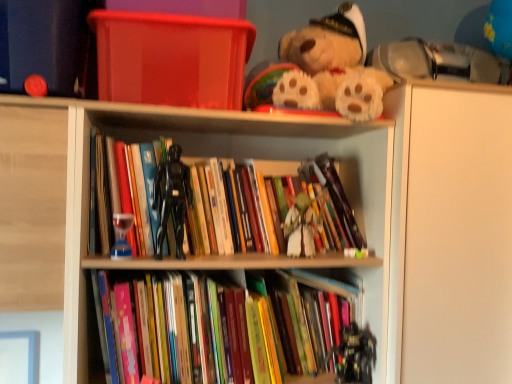
This screenshot has height=384, width=512. I want to click on multicolored paperbacks at center, the 1th book from the top, so click(x=248, y=209).

What do you see at coordinates (248, 209) in the screenshot? The width and height of the screenshot is (512, 384). I see `multicolored paperbacks at center, positioned as the 2th book in bottom-to-top order` at bounding box center [248, 209].

The height and width of the screenshot is (384, 512). Describe the element at coordinates (170, 58) in the screenshot. I see `transparent plastic container at upper center` at that location.

The width and height of the screenshot is (512, 384). Find the location of `white matte figurine at center, which appears as the 1th miniature when viewed from the right`. white matte figurine at center, which appears as the 1th miniature when viewed from the right is located at coordinates (300, 227).

How much space does black plastic robot at lower center, which is the first toy in right-to-left order, occupy vertically?

It is 7.10 inches.

Where is `white matte cabinet at upper right`? The width and height of the screenshot is (512, 384). white matte cabinet at upper right is located at coordinates (450, 234).

Identify the location of translucent glass hourglass at center, acting as the 1th toy starting from the front. (122, 235).

This screenshot has height=384, width=512. Identify the location of multicolored paperbacks at center, positioned as the 2th book in bottom-to-top order. 248,209.

From a real-world perspective, between white matte figurine at center, marked as the first miniature in a back-to-front arrangement, and white matte cabinet at upper right, who is vertically higher?

white matte figurine at center, marked as the first miniature in a back-to-front arrangement, from a real-world perspective.

How many degrees apart are the facing directions of white matte figurine at center, acting as the 2th miniature starting from the left, and white matte cabinet at upper right?

1.98 degrees separate the facing orientations of white matte figurine at center, acting as the 2th miniature starting from the left, and white matte cabinet at upper right.

Can you confirm if white matte figurine at center, acting as the 2th miniature starting from the left, is positioned to the left of white matte cabinet at upper right?

Yes, white matte figurine at center, acting as the 2th miniature starting from the left, is to the left of white matte cabinet at upper right.

What are the coordinates of `the 1st miniature to the left of the white matte cabinet at upper right, counting from the anchor's position` in the screenshot? It's located at (300, 227).

How far apart are white matte cabinet at upper right and hardcover books at center, marked as the second book in a top-to-bottom arrangement?

white matte cabinet at upper right and hardcover books at center, marked as the second book in a top-to-bottom arrangement, are 16.18 inches apart from each other.

Considering their positions, is white matte cabinet at upper right located in front of or behind hardcover books at center, which is the first book in bottom-to-top order?

white matte cabinet at upper right is behind hardcover books at center, which is the first book in bottom-to-top order.

How many degrees apart are the facing directions of white matte cabinet at upper right and hardcover books at center, marked as the second book in a top-to-bottom arrangement?

1.96 degrees separate the facing orientations of white matte cabinet at upper right and hardcover books at center, marked as the second book in a top-to-bottom arrangement.

Is white matte cabinet at upper right thinner than hardcover books at center, marked as the second book in a top-to-bottom arrangement?

Incorrect, the width of white matte cabinet at upper right is not less than that of hardcover books at center, marked as the second book in a top-to-bottom arrangement.

Between white matte cabinet at upper right and black plastic robot at lower center, the 1th toy viewed from the back, which one is positioned behind?

black plastic robot at lower center, the 1th toy viewed from the back.

How many degrees apart are the facing directions of white matte cabinet at upper right and black plastic robot at lower center, placed as the 2th toy when sorted from front to back?

66.5 degrees.

Which is more to the left, white matte cabinet at upper right or black plastic robot at lower center, the second toy when ordered from top to bottom?

black plastic robot at lower center, the second toy when ordered from top to bottom.

The image size is (512, 384). Identify the location of dresser that is on the right side of black plastic robot at lower center, the second toy when ordered from top to bottom. (450, 234).

Based on the photo, from the image's perspective, which is above, black matte figure at center, the first miniature in the front-to-back sequence, or translucent glass hourglass at center, acting as the 1th toy starting from the front?

black matte figure at center, the first miniature in the front-to-back sequence.

Is black matte figure at center, which is the second miniature from back to front, further to camera compared to translucent glass hourglass at center, acting as the second toy starting from the back?

No, black matte figure at center, which is the second miniature from back to front, is in front of translucent glass hourglass at center, acting as the second toy starting from the back.

How different are the orientations of black matte figure at center, the first miniature in the front-to-back sequence, and translucent glass hourglass at center, which is the 2th toy from bottom to top, in degrees?

0.0054 degrees.

Can you confirm if black matte figure at center, placed as the 2th miniature when sorted from right to left, is shorter than translucent glass hourglass at center, acting as the first toy starting from the left?

No.

Who is shorter, wooden books at center or white matte figurine at center, marked as the first miniature in a back-to-front arrangement?

Standing shorter between the two is white matte figurine at center, marked as the first miniature in a back-to-front arrangement.

What's the angular difference between wooden books at center and white matte figurine at center, placed as the 2th miniature when sorted from front to back,'s facing directions?

The facing directions of wooden books at center and white matte figurine at center, placed as the 2th miniature when sorted from front to back, are 2.32 degrees apart.

Is wooden books at center in contact with white matte figurine at center, which appears as the 1th miniature when viewed from the right?

No, wooden books at center is not touching white matte figurine at center, which appears as the 1th miniature when viewed from the right.

Considering their positions, is wooden books at center located in front of or behind white matte figurine at center, placed as the 2th miniature when sorted from front to back?

Visually, wooden books at center is located in front of white matte figurine at center, placed as the 2th miniature when sorted from front to back.

Is point (27, 286) more distant than point (181, 148)?

No, it is in front of (181, 148).

Between wooden books at center and black matte figure at center, which is the second miniature from back to front, which one has smaller size?

black matte figure at center, which is the second miniature from back to front.

Consider the image. From the image's perspective, which object appears higher, wooden books at center or black matte figure at center, placed as the 2th miniature when sorted from right to left?

black matte figure at center, placed as the 2th miniature when sorted from right to left, appears higher in the image.

How different are the orientations of wooden books at center and black matte figure at center, which is the 1th miniature from left to right, in degrees?

wooden books at center and black matte figure at center, which is the 1th miniature from left to right, are facing 1.07 degrees away from each other.

Considering the sizes of objects hardcover books at center, which is the first book in bottom-to-top order, and translucent glass hourglass at center, acting as the 1th toy starting from the front, in the image provided, who is thinner, hardcover books at center, which is the first book in bottom-to-top order, or translucent glass hourglass at center, acting as the 1th toy starting from the front,?

Thinner between the two is translucent glass hourglass at center, acting as the 1th toy starting from the front.

Consider the image. Considering the sizes of objects hardcover books at center, which is the first book in bottom-to-top order, and translucent glass hourglass at center, acting as the 1th toy starting from the front, in the image provided, who is taller, hardcover books at center, which is the first book in bottom-to-top order, or translucent glass hourglass at center, acting as the 1th toy starting from the front,?

Standing taller between the two is hardcover books at center, which is the first book in bottom-to-top order.

Is hardcover books at center, marked as the second book in a top-to-bottom arrangement, inside or outside of translucent glass hourglass at center, which is the 2th toy from bottom to top?

hardcover books at center, marked as the second book in a top-to-bottom arrangement, is located beyond the bounds of translucent glass hourglass at center, which is the 2th toy from bottom to top.

From the picture: Considering the positions of objects hardcover books at center, which is the first book in bottom-to-top order, and translucent glass hourglass at center, which is the 2th toy from bottom to top, in the image provided, who is behind, hardcover books at center, which is the first book in bottom-to-top order, or translucent glass hourglass at center, which is the 2th toy from bottom to top,?

hardcover books at center, which is the first book in bottom-to-top order.

Where is `the 1st miniature positioned above the white matte cabinet at upper right (from the image's perspective)`? This screenshot has height=384, width=512. the 1st miniature positioned above the white matte cabinet at upper right (from the image's perspective) is located at coordinates click(x=300, y=227).

Where is `the 2nd book to the left when counting from the white matte cabinet at upper right`? The width and height of the screenshot is (512, 384). the 2nd book to the left when counting from the white matte cabinet at upper right is located at coordinates (222, 330).

Estimate the real-world distances between objects in this image. Which object is closer to white matte figurine at center, marked as the first miniature in a back-to-front arrangement, hardcover books at center, which is the first book in bottom-to-top order, or black matte figure at center, which is the 1th miniature from left to right?

Among the two, hardcover books at center, which is the first book in bottom-to-top order, is located nearer to white matte figurine at center, marked as the first miniature in a back-to-front arrangement.

Which object lies nearer to the anchor point fluffy beige teddy bear at upper center, hardcover books at center, which is the first book in bottom-to-top order, or transparent plastic container at upper center?

The object closer to fluffy beige teddy bear at upper center is transparent plastic container at upper center.

When comparing their distances from hardcover books at center, marked as the second book in a top-to-bottom arrangement, does fluffy beige teddy bear at upper center or white matte cabinet at upper right seem further?

The object further to hardcover books at center, marked as the second book in a top-to-bottom arrangement, is fluffy beige teddy bear at upper center.

From the image, which object appears to be nearer to translucent glass hourglass at center, acting as the first toy starting from the left, white matte cabinet at upper right or black plastic robot at lower center, which is counted as the first toy, starting from the bottom?

black plastic robot at lower center, which is counted as the first toy, starting from the bottom, is positioned closer to the anchor translucent glass hourglass at center, acting as the first toy starting from the left.

Estimate the real-world distances between objects in this image. Which object is further from black matte figure at center, the first miniature in the front-to-back sequence, black plastic robot at lower center, the second toy when ordered from top to bottom, or fluffy beige teddy bear at upper center?

black plastic robot at lower center, the second toy when ordered from top to bottom, lies further to black matte figure at center, the first miniature in the front-to-back sequence, than the other object.

Which object lies nearer to the anchor point translucent glass hourglass at center, which is the 2th toy from bottom to top, white matte cabinet at upper right or black matte figure at center, the first miniature in the front-to-back sequence?

Among the two, black matte figure at center, the first miniature in the front-to-back sequence, is located nearer to translucent glass hourglass at center, which is the 2th toy from bottom to top.

Based on their spatial positions, is translucent glass hourglass at center, acting as the first toy starting from the top, or black plastic robot at lower center, placed as the 2th toy when sorted from front to back, closer to white matte figurine at center, placed as the 2th miniature when sorted from front to back?

Based on the image, black plastic robot at lower center, placed as the 2th toy when sorted from front to back, appears to be nearer to white matte figurine at center, placed as the 2th miniature when sorted from front to back.

Based on their spatial positions, is hardcover books at center, marked as the second book in a top-to-bottom arrangement, or transparent plastic container at upper center further from multicolored paperbacks at center, the 1th book from the top?

Based on the image, transparent plastic container at upper center appears to be further to multicolored paperbacks at center, the 1th book from the top.

Find the location of a particular element. Image resolution: width=512 pixels, height=384 pixels. miniature that lies between black matte figure at center, which is the second miniature from back to front, and hardcover books at center, which is the first book in bottom-to-top order, from top to bottom is located at coordinates pyautogui.click(x=300, y=227).

Identify the location of box located between translucent glass hourglass at center, acting as the 1th toy starting from the front, and white matte cabinet at upper right in the left-right direction. (170, 58).

Identify the location of miniature between fluffy beige teddy bear at upper center and white matte figurine at center, marked as the first miniature in a back-to-front arrangement, in the vertical direction. Image resolution: width=512 pixels, height=384 pixels. (170, 199).

This screenshot has width=512, height=384. I want to click on toy between white matte figurine at center, which appears as the 1th miniature when viewed from the right, and white matte cabinet at upper right, so click(x=355, y=355).